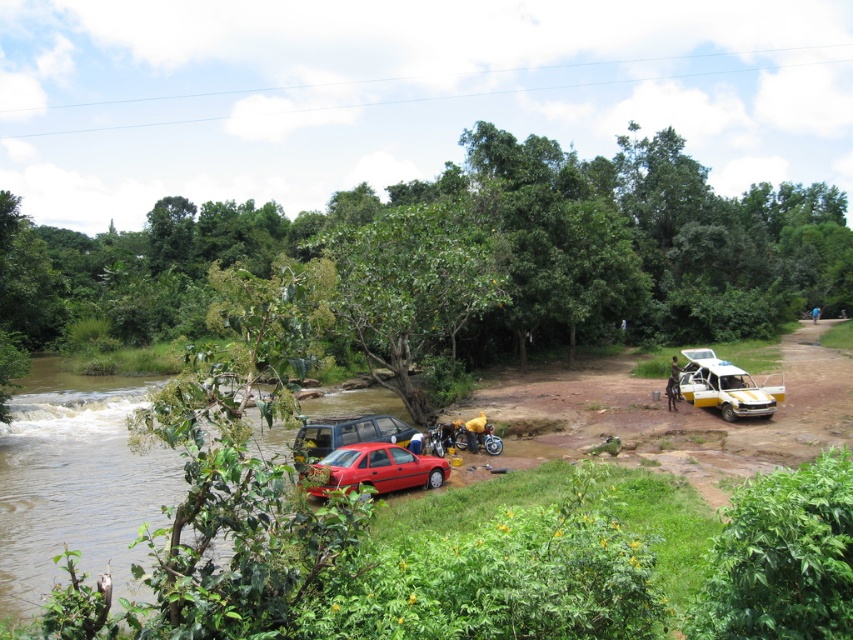
This screenshot has height=640, width=853. What do you see at coordinates (74, 481) in the screenshot?
I see `smooth brown water at lower left` at bounding box center [74, 481].

Does point (78, 508) come in front of point (395, 472)?

No, it is not.

Image resolution: width=853 pixels, height=640 pixels. I want to click on smooth brown water at lower left, so click(x=74, y=481).

Locate an element on the screen. The height and width of the screenshot is (640, 853). smooth brown water at lower left is located at coordinates (74, 481).

Is smooth brown water at lower left positioned at the back of yellow matte car at right?

That is False.

Is point (22, 593) closer to viewer compared to point (734, 397)?

Yes, it is.

Where is `smooth brown water at lower left`? The width and height of the screenshot is (853, 640). smooth brown water at lower left is located at coordinates (74, 481).

Based on the photo, does shiny red car at lower center appear under yellow matte car at right?

Indeed, shiny red car at lower center is positioned under yellow matte car at right.

What do you see at coordinates (376, 468) in the screenshot? This screenshot has height=640, width=853. I see `shiny red car at lower center` at bounding box center [376, 468].

Find the location of `shiny red car at lower center`. shiny red car at lower center is located at coordinates (376, 468).